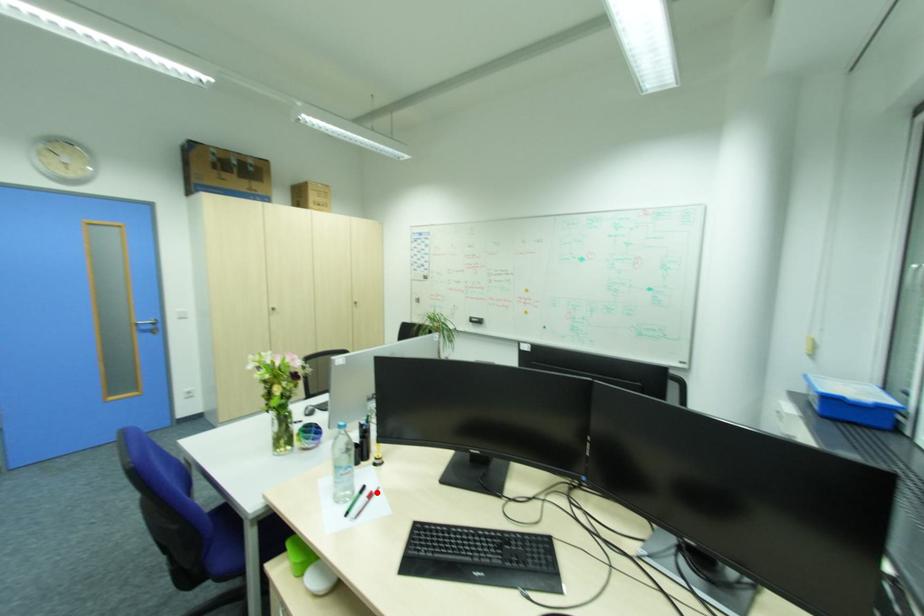
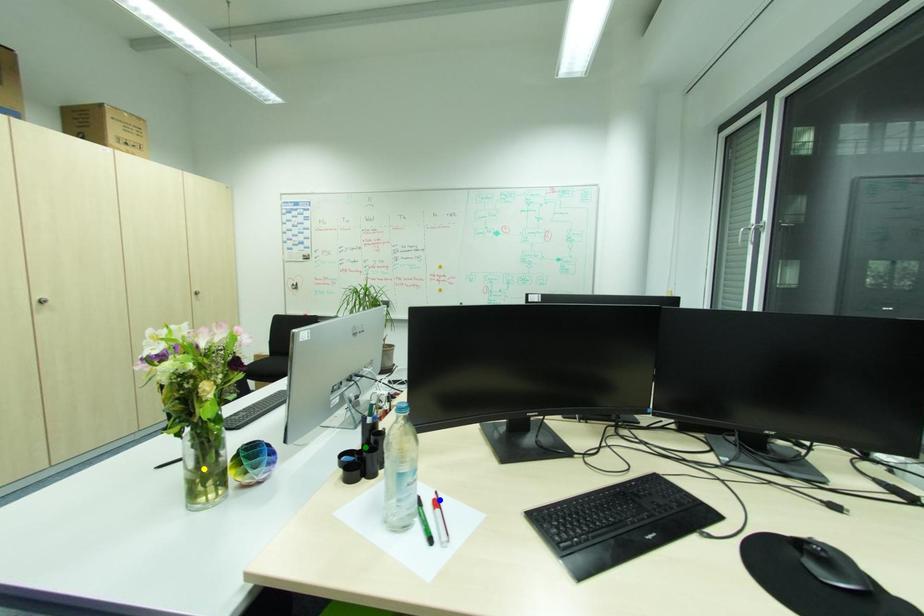
Question: I am providing you with two images of the same scene from different viewpoints. A red point is marked on the first image. You are given multiple points on the second image. Which point in image 2 is actually the same real-world point as the red point in image 1?

Choices:
 (A) blue point
 (B) green point
 (C) yellow point

Answer: (A)